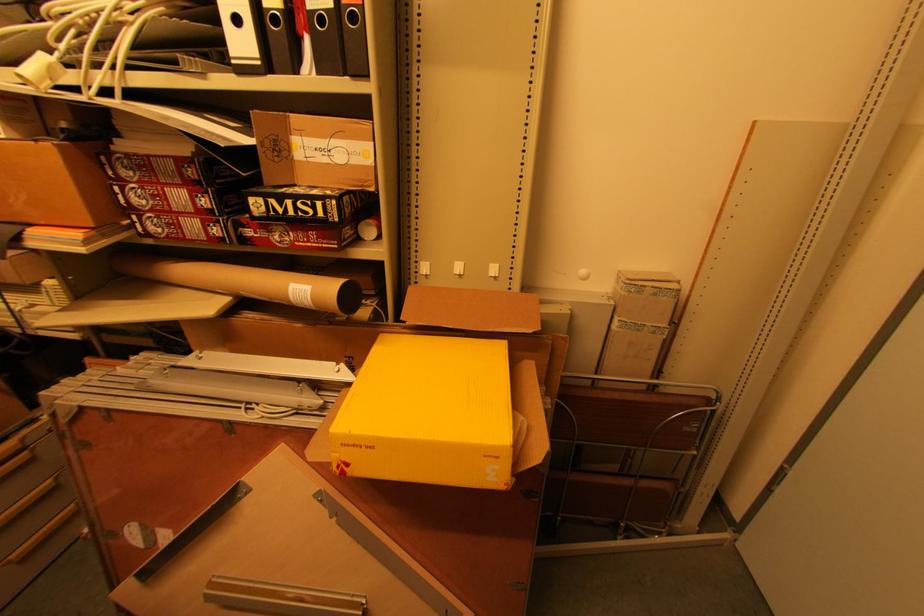
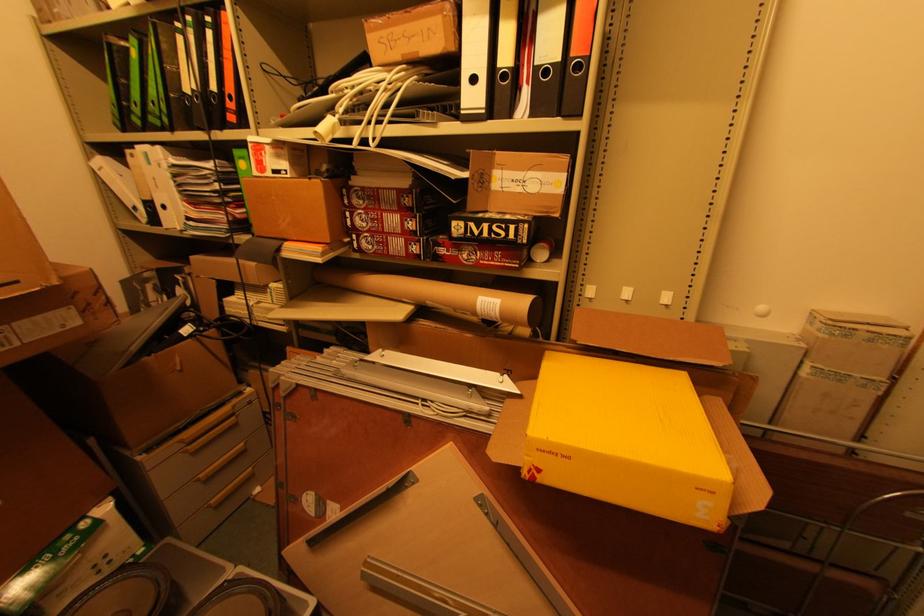
Question: The images are taken continuously from a first-person perspective. In which direction are you moving?

Choices:
 (A) Left
 (B) Right
 (C) Forward
 (D) Backward

Answer: (A)